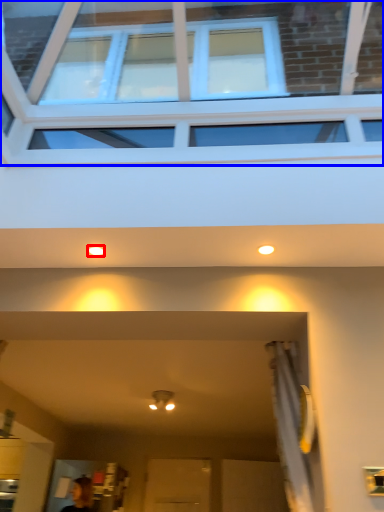
Question: Which object appears farthest to the camera in this image, lighting (highlighted by a red box) or window (highlighted by a blue box)?

Choices:
 (A) lighting
 (B) window

Answer: (A)